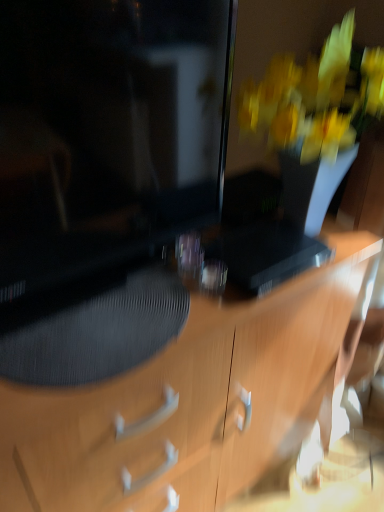
Question: From a real-world perspective, is black textured drawer at center positioned under matte black monitor at left based on gravity?

Choices:
 (A) yes
 (B) no

Answer: (A)

Question: Does black textured drawer at center have a greater height compared to matte black monitor at left?

Choices:
 (A) no
 (B) yes

Answer: (A)

Question: Can you confirm if black textured drawer at center is shorter than matte black monitor at left?

Choices:
 (A) yes
 (B) no

Answer: (A)

Question: Does black textured drawer at center appear on the left side of matte black monitor at left?

Choices:
 (A) no
 (B) yes

Answer: (B)

Question: Would you consider black textured drawer at center to be distant from matte black monitor at left?

Choices:
 (A) no
 (B) yes

Answer: (A)

Question: Is black textured drawer at center looking in the opposite direction of matte black monitor at left?

Choices:
 (A) no
 (B) yes

Answer: (B)

Question: Can you confirm if matte black monitor at left is smaller than black textured drawer at center?

Choices:
 (A) yes
 (B) no

Answer: (B)

Question: Does matte black monitor at left appear on the left side of black textured drawer at center?

Choices:
 (A) yes
 (B) no

Answer: (B)

Question: Considering the relative sizes of matte black monitor at left and black textured drawer at center in the image provided, is matte black monitor at left wider than black textured drawer at center?

Choices:
 (A) yes
 (B) no

Answer: (B)

Question: Would you consider matte black monitor at left to be distant from black textured drawer at center?

Choices:
 (A) no
 (B) yes

Answer: (A)

Question: From a real-world perspective, is matte black monitor at left located beneath black textured drawer at center?

Choices:
 (A) no
 (B) yes

Answer: (A)

Question: Is matte black monitor at left facing towards black textured drawer at center?

Choices:
 (A) no
 (B) yes

Answer: (B)

Question: Can you confirm if black textured drawer at center is smaller than wooden desk at center?

Choices:
 (A) no
 (B) yes

Answer: (B)